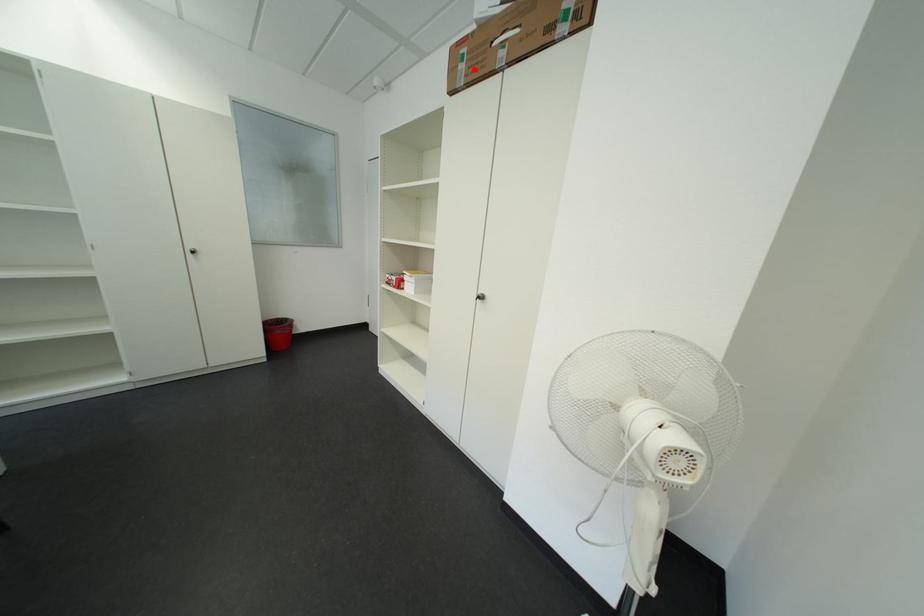
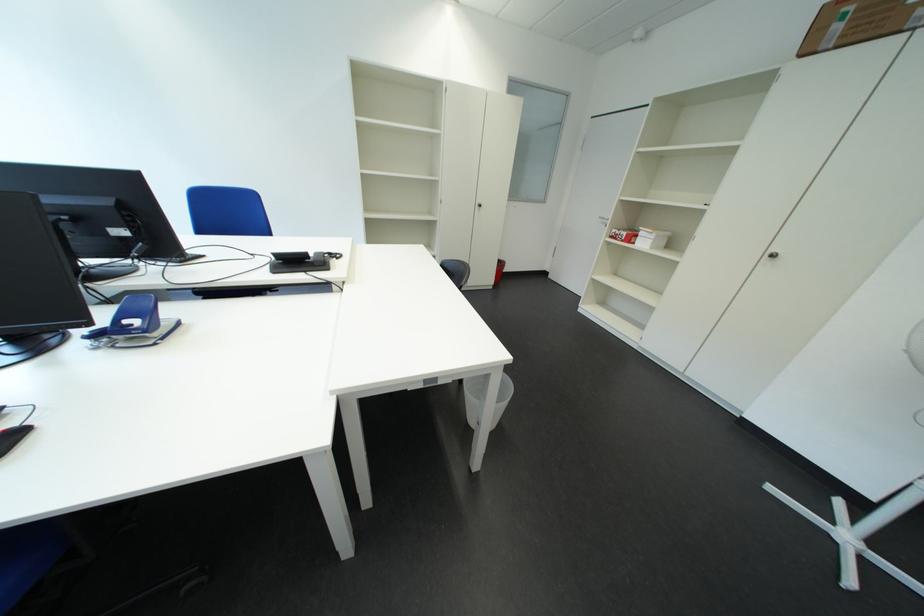
Question: A red point is marked in image1. In image2, is the corresponding 3D point closer to the camera or farther? Reply with the corresponding letter.

Choices:
 (A) The corresponding 3D point is closer.
 (B) The corresponding 3D point is farther.

Answer: (B)